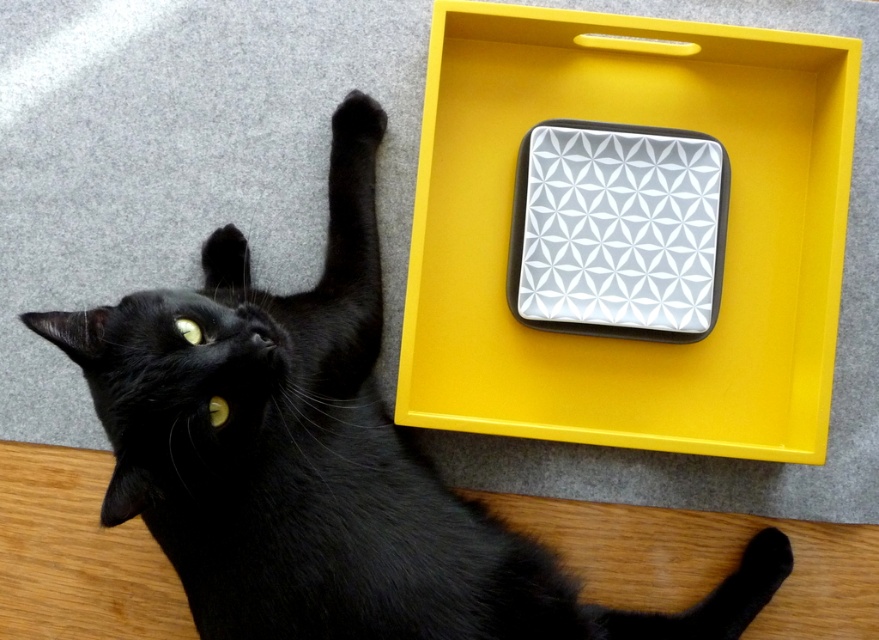
Does white glossy square at center have a lesser width compared to black fur paw at upper left?

Incorrect, white glossy square at center's width is not less than black fur paw at upper left's.

Who is higher up, white glossy square at center or black fur paw at upper left?

black fur paw at upper left is above.

This screenshot has height=640, width=879. In order to click on white glossy square at center in this screenshot , I will do `click(618, 230)`.

Find the location of `white glossy square at center`. white glossy square at center is located at coordinates (618, 230).

In the scene shown: Is yellow matte tray at upper right to the left of white glossy square at center from the viewer's perspective?

Correct, you'll find yellow matte tray at upper right to the left of white glossy square at center.

Is point (607, 72) more distant than point (543, 253)?

Yes, it is behind point (543, 253).

The width and height of the screenshot is (879, 640). Find the location of `yellow matte tray at upper right`. yellow matte tray at upper right is located at coordinates (725, 234).

Is yellow matte tray at upper right below black fur paw at upper left?

Correct, yellow matte tray at upper right is located below black fur paw at upper left.

Who is positioned more to the right, yellow matte tray at upper right or black fur paw at upper left?

Positioned to the right is yellow matte tray at upper right.

Locate an element on the screen. The width and height of the screenshot is (879, 640). yellow matte tray at upper right is located at coordinates (725, 234).

Where is `yellow matte tray at upper right`? The height and width of the screenshot is (640, 879). yellow matte tray at upper right is located at coordinates pos(725,234).